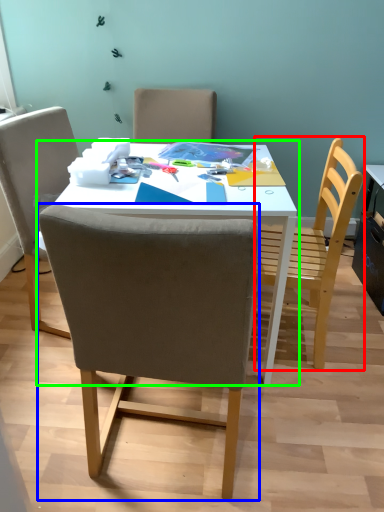
Question: Estimate the real-world distances between objects in this image. Which object is farther from chair (highlighted by a red box), chair (highlighted by a blue box) or table (highlighted by a green box)?

Choices:
 (A) chair
 (B) table

Answer: (A)